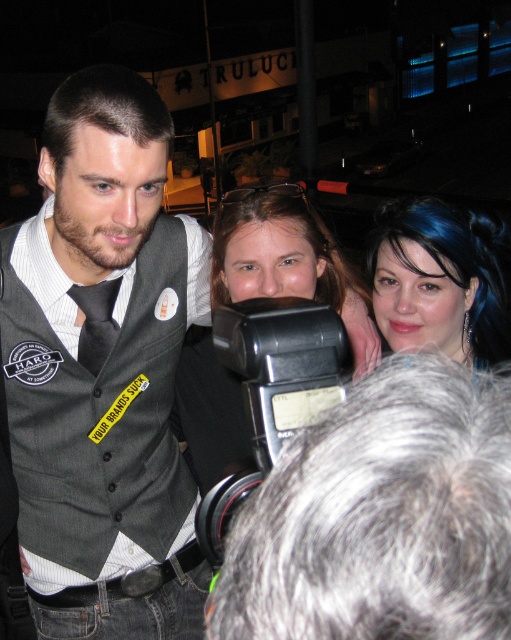
You are a fashion designer observing the scene. You notice the gray fabric vest at center and the dark gray silk tie at center. Which item do you think has a greater width?

The gray fabric vest at center is wider than the dark gray silk tie at center according to the description.

Based on the photo, you are a fashion designer observing the image. You notice the gray fabric vest at center and the dark gray silk tie at center. Which clothing item is positioned lower on the person?

The gray fabric vest at center is positioned lower than the dark gray silk tie at center.